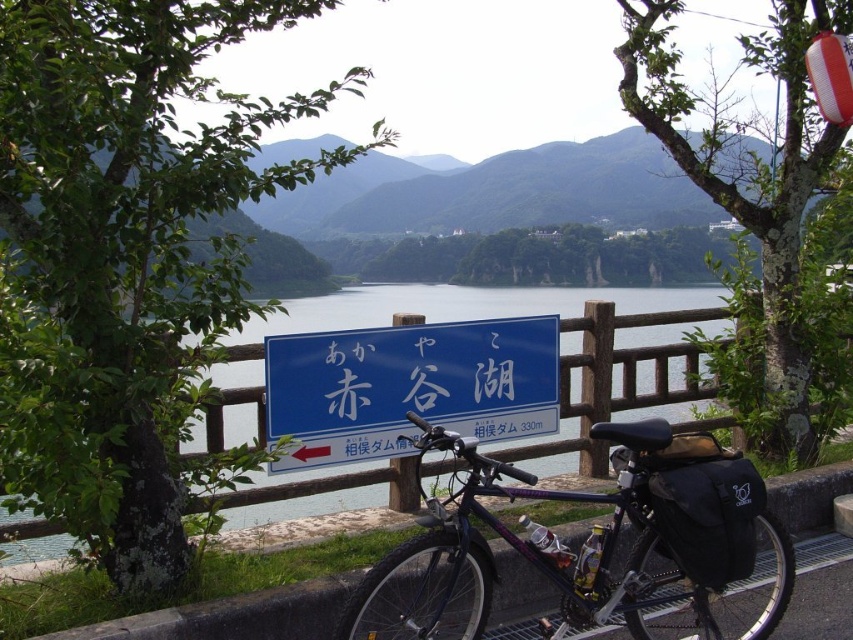
Can you confirm if metallic purple bicycle at center is positioned to the left of blue plastic sign at center?

No, metallic purple bicycle at center is not to the left of blue plastic sign at center.

Does point (645, 595) lie behind point (404, 384)?

No, it is not.

Is point (596, 560) closer to viewer compared to point (426, 346)?

Yes, point (596, 560) is in front of point (426, 346).

Where is `metallic purple bicycle at center`? Image resolution: width=853 pixels, height=640 pixels. metallic purple bicycle at center is located at coordinates (587, 538).